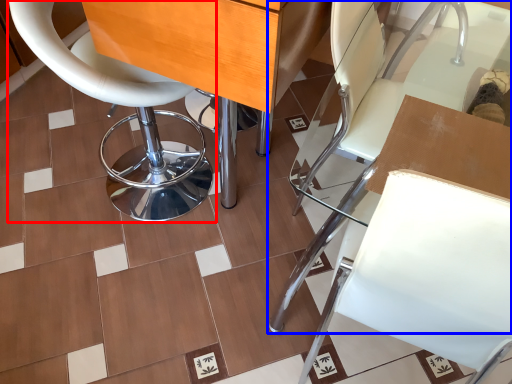
Question: Which object appears closest to the camera in this image, chair (highlighted by a red box) or chair (highlighted by a blue box)?

Choices:
 (A) chair
 (B) chair

Answer: (B)